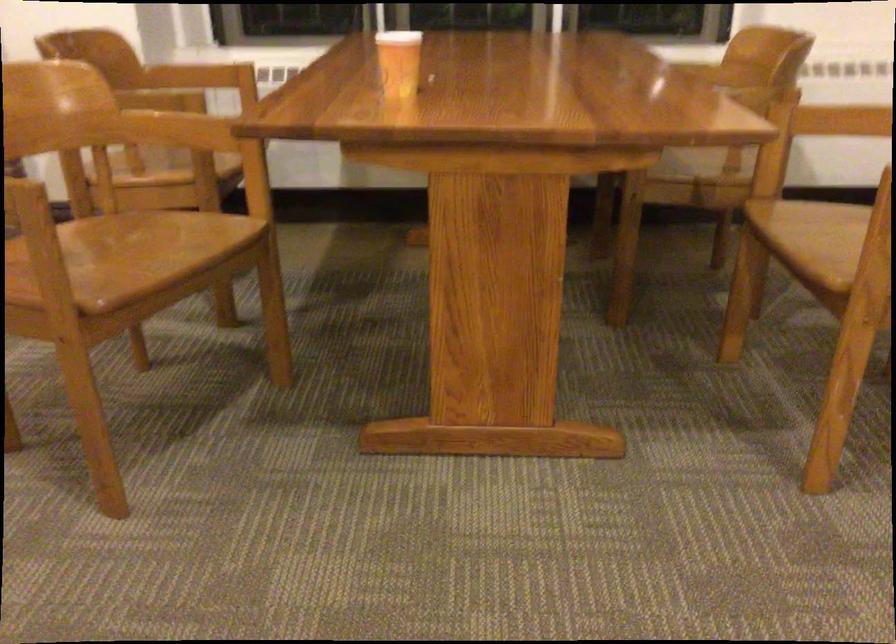
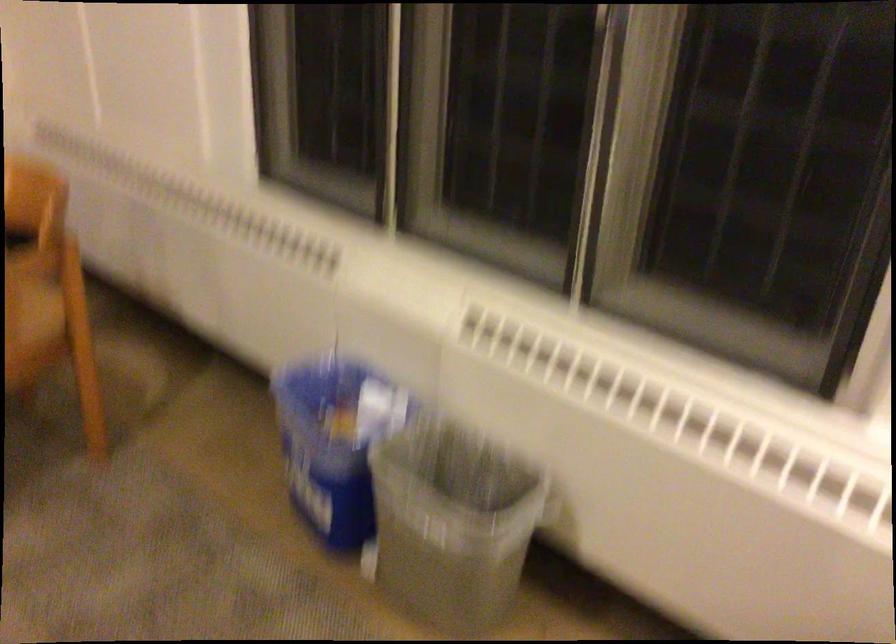
Question: The first image is from the beginning of the video and the second image is from the end. How did the camera likely rotate when shooting the video?

Choices:
 (A) Left
 (B) Right
 (C) Up
 (D) Down

Answer: (B)